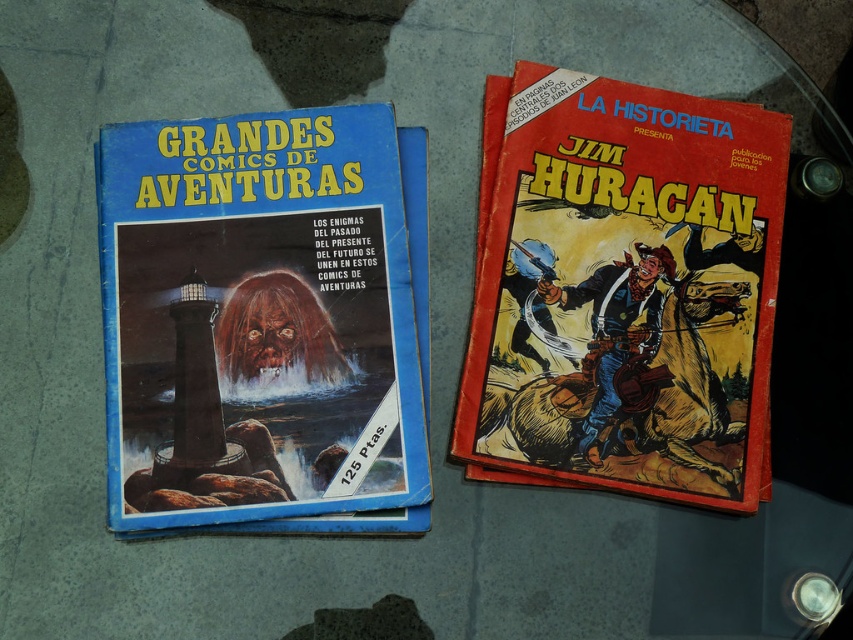
Who is more forward, [285,435] or [737,440]?

Point [285,435] is in front.

Identify the location of blue paper comic book at left. (257, 320).